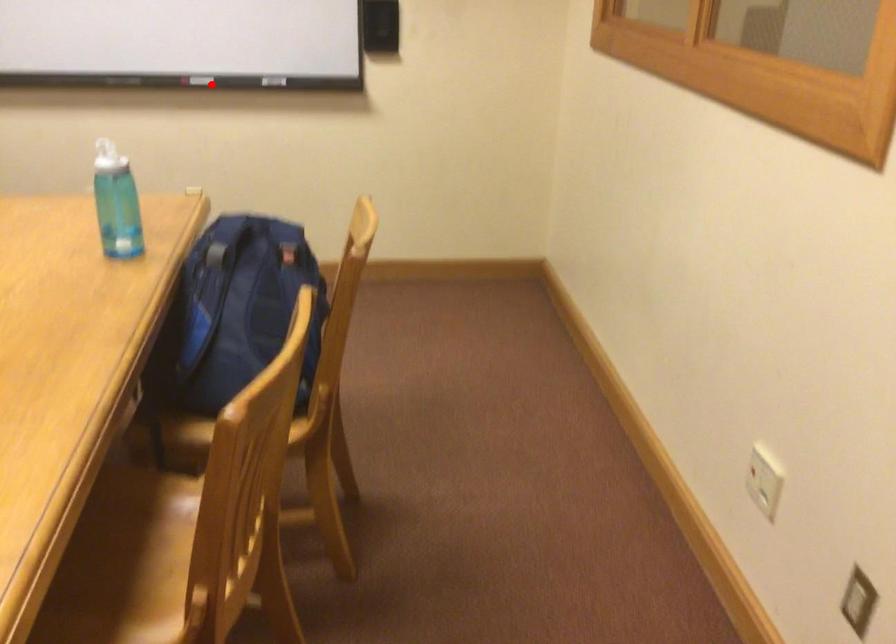
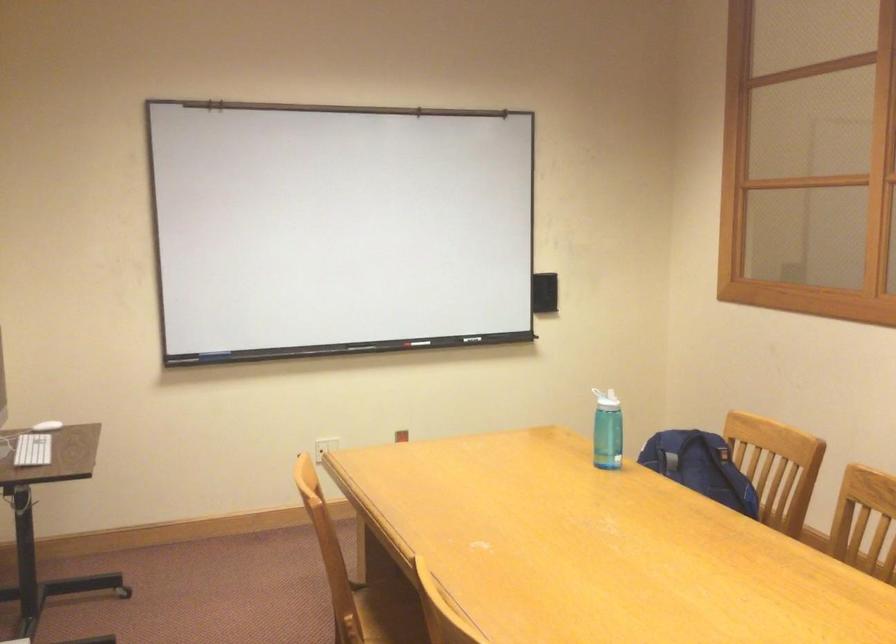
Question: I am providing you with two images of the same scene from different viewpoints. Image1 has a red point marked. In image2, the corresponding 3D location appears at what relative position? Reply with the corresponding letter.

Choices:
 (A) Closer
 (B) Farther

Answer: (B)